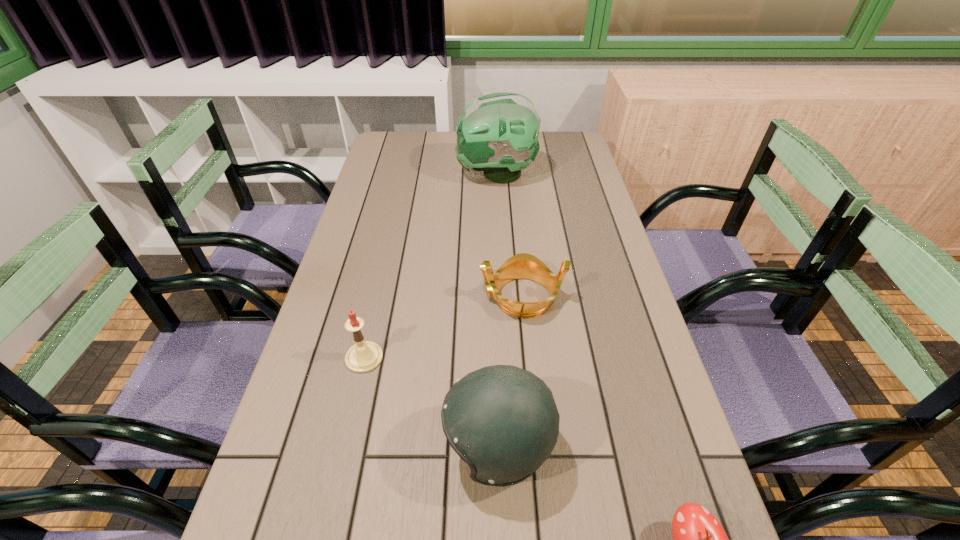
The image size is (960, 540). I want to click on free space between the taller football helmet and the third nearest object, so click(430, 266).

You are a GUI agent. You are given a task and a screenshot of the screen. Output one action in this format:
    pyautogui.click(x=<x>, y=<y>)
    Task: Click on the free space between the tallest object and the second farthest object
    Image resolution: width=960 pixels, height=540 pixels.
    Given the screenshot: What is the action you would take?
    pyautogui.click(x=509, y=235)

Locate an element on the screen. This screenshot has width=960, height=540. the fourth closest object to the second farthest object is located at coordinates (699, 539).

The width and height of the screenshot is (960, 540). I want to click on object that is the closest to the farthest object, so click(x=520, y=266).

Locate an element on the screen. The image size is (960, 540). vacant space that satisfies the following two spatial constraints: 1. at the front emblem of the second farthest object; 2. on the front side of the candle is located at coordinates (528, 357).